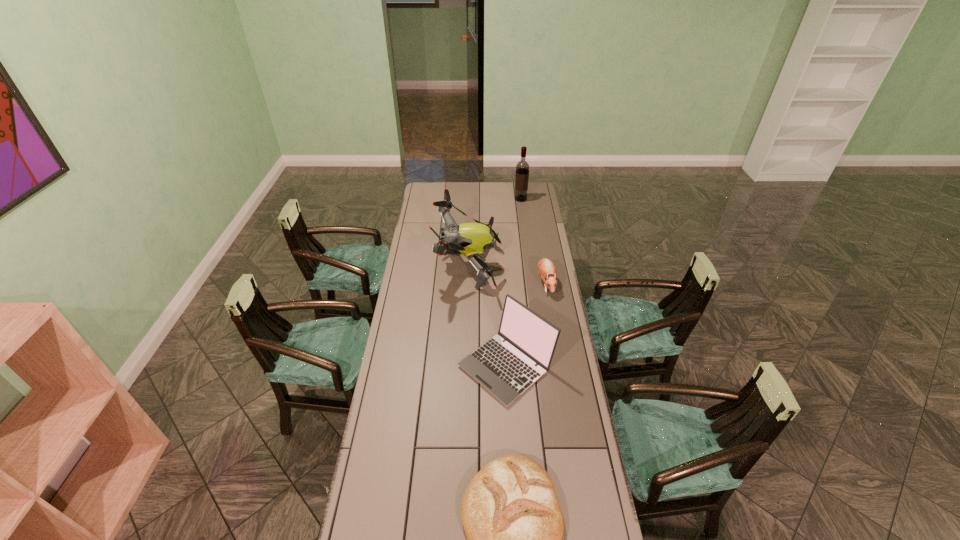
Find the location of a particular element. The width and height of the screenshot is (960, 540). free point at the far left corner is located at coordinates (432, 188).

Where is `unoccupied area between the drone and the hamster`? unoccupied area between the drone and the hamster is located at coordinates (507, 274).

Locate an element on the screen. The height and width of the screenshot is (540, 960). unoccupied position between the second shortest object and the farthest object is located at coordinates (533, 241).

In order to click on empty space between the farthest object and the third tallest object in this screenshot , I will do `click(514, 282)`.

Where is `empty location between the drone and the fourth tallest object`? empty location between the drone and the fourth tallest object is located at coordinates (507, 274).

Find the location of a particular element. object that is the second closest one to the drone is located at coordinates (546, 269).

You are a GUI agent. You are given a task and a screenshot of the screen. Output one action in this format:
    pyautogui.click(x=<x>, y=<y>)
    Task: Click on the third closest object to the drone
    The width and height of the screenshot is (960, 540).
    Given the screenshot: What is the action you would take?
    pyautogui.click(x=522, y=168)

You are a GUI agent. You are given a task and a screenshot of the screen. Output one action in this format:
    pyautogui.click(x=<x>, y=<y>)
    Task: Click on the vacant point that satisfies the following two spatial constraints: 1. at the face of the second shortest object; 2. at the front screen of the second nearest object
    The width and height of the screenshot is (960, 540).
    Given the screenshot: What is the action you would take?
    pyautogui.click(x=560, y=366)